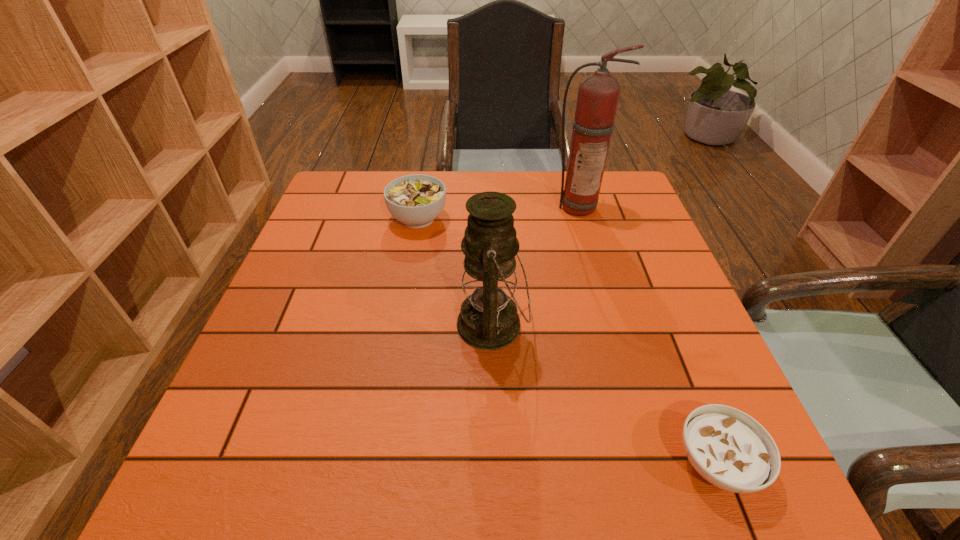
The height and width of the screenshot is (540, 960). I want to click on free space at the left edge, so click(x=281, y=414).

At what (x,y) coordinates should I click in order to perform the action: click on vacant space at the right edge of the desktop. Please return your answer as a coordinate pair (x, y). This screenshot has height=540, width=960. Looking at the image, I should click on (618, 244).

In the image, there is a desktop. Identify the location of vacant space at the far left corner. This screenshot has height=540, width=960. (339, 213).

Find the location of a particular element. The width and height of the screenshot is (960, 540). vacant space in between the left soup bowl and the nearest object is located at coordinates (567, 341).

This screenshot has height=540, width=960. I want to click on vacant area that lies between the second tallest object and the fire extinguisher, so click(535, 266).

Find the location of a particular element. The height and width of the screenshot is (540, 960). free space that is in between the tallest object and the third farthest object is located at coordinates (535, 266).

This screenshot has width=960, height=540. What are the coordinates of `free space between the taller soup bowl and the shortest object` in the screenshot? It's located at (567, 341).

Where is `unoccupied position between the shortest object and the fire extinguisher`? This screenshot has height=540, width=960. unoccupied position between the shortest object and the fire extinguisher is located at coordinates (647, 334).

The width and height of the screenshot is (960, 540). Find the location of `empty space that is in between the farther soup bowl and the right soup bowl`. empty space that is in between the farther soup bowl and the right soup bowl is located at coordinates (567, 341).

Identify the location of free spot between the fire extinguisher and the oil lamp. This screenshot has width=960, height=540. (535, 266).